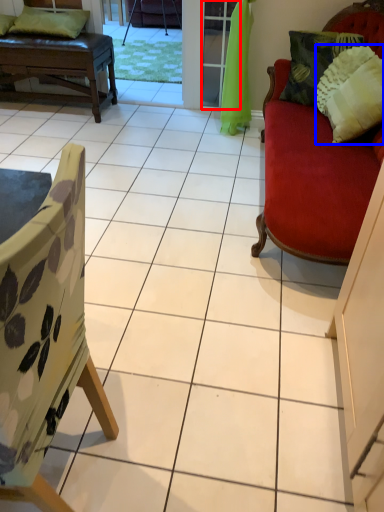
Question: Among these objects, which one is farthest to the camera, screen door (highlighted by a red box) or pillow (highlighted by a blue box)?

Choices:
 (A) screen door
 (B) pillow

Answer: (A)